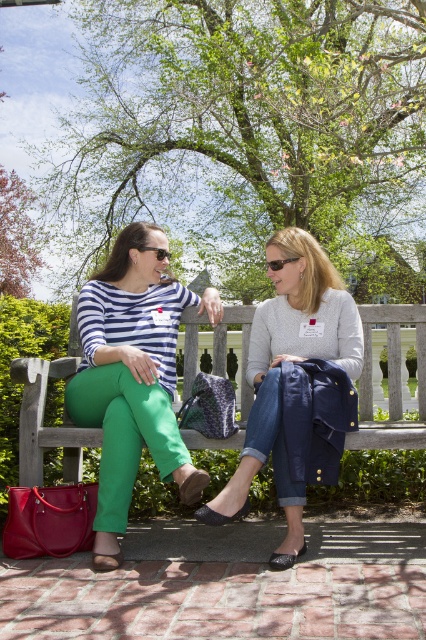
You are a photographer standing 2 meters away from the two women. You want to take a photo that includes both the matte striped shirt at center and the black plastic sunglasses at center without any part of them being cut off. What is the minimum width of your camera lens field of view required to capture both objects?

The minimum width of the camera lens field of view required to capture both the matte striped shirt at center and the black plastic sunglasses at center is 1.25 meters, as they are 1.25 meters apart from each other.

Based on the scene description, where is the matte striped shirt at center located in terms of its 2D coordinates?

The matte striped shirt at center is located at the 2D coordinates point (132, 376).